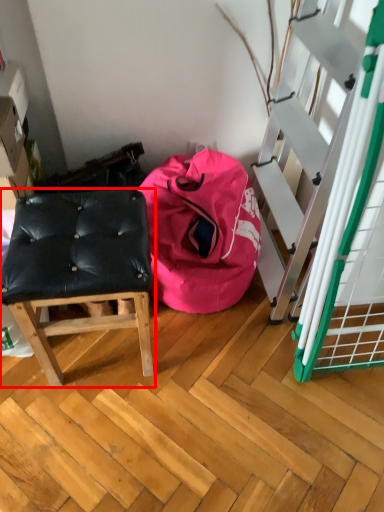
Question: From the image, what is the correct spatial relationship of furniture (annotated by the red box) in relation to bean bag chair?

Choices:
 (A) right
 (B) left

Answer: (B)